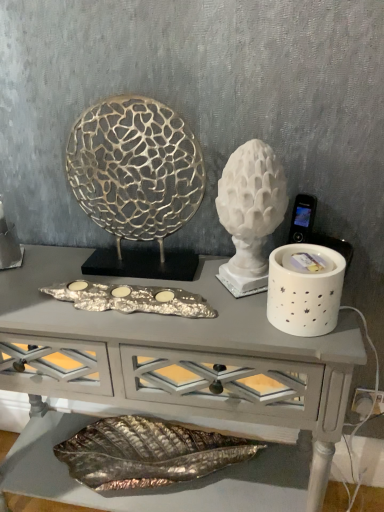
Question: Relative to silver metallic tray at center, is white marble sculpture at center, which is the second sculpture from left to right, in front or behind?

Choices:
 (A) behind
 (B) front

Answer: (B)

Question: From their relative heights in the image, would you say white marble sculpture at center, which is the second sculpture from left to right, is taller or shorter than silver metallic tray at center?

Choices:
 (A) tall
 (B) short

Answer: (A)

Question: Which object is the closest to the gold textured sculpture at center, the second sculpture viewed from the right?

Choices:
 (A) white glossy candle holder at upper right
 (B) silver metallic tray at center
 (C) white ceramic candle holder at right
 (D) white marble sculpture at center, which is the second sculpture from left to right

Answer: (D)

Question: Estimate the real-world distances between objects in this image. Which object is closer to the gold textured sculpture at center, the 1th sculpture from the left?

Choices:
 (A) silver metallic tray at center
 (B) white marble sculpture at center, which is the second sculpture from left to right
 (C) white ceramic candle holder at right
 (D) white glossy candle holder at upper right

Answer: (B)